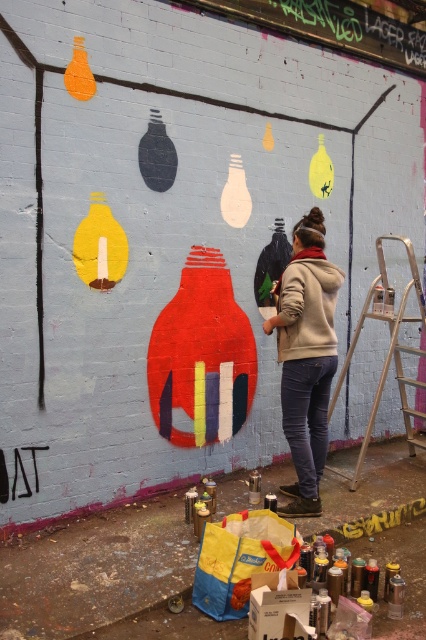
Is beige fleece jacket at center below metallic silver step ladder at right?

Yes.

What do you see at coordinates (305, 356) in the screenshot? I see `beige fleece jacket at center` at bounding box center [305, 356].

Where is `beige fleece jacket at center`? The height and width of the screenshot is (640, 426). beige fleece jacket at center is located at coordinates click(x=305, y=356).

At what (x,y) coordinates should I click in order to perform the action: click on beige fleece jacket at center. Please return your answer as a coordinate pair (x, y). Image resolution: width=426 pixels, height=640 pixels. Looking at the image, I should click on (305, 356).